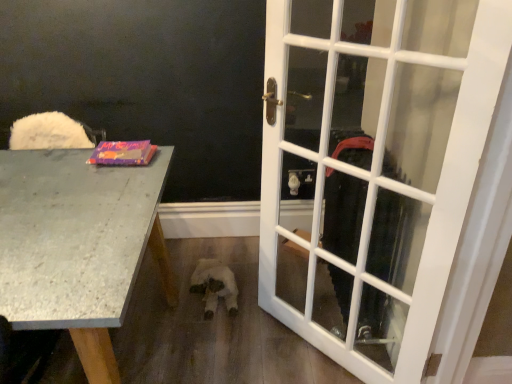
Find the location of `vacant space in front of white plush toy at center`. vacant space in front of white plush toy at center is located at coordinates (208, 331).